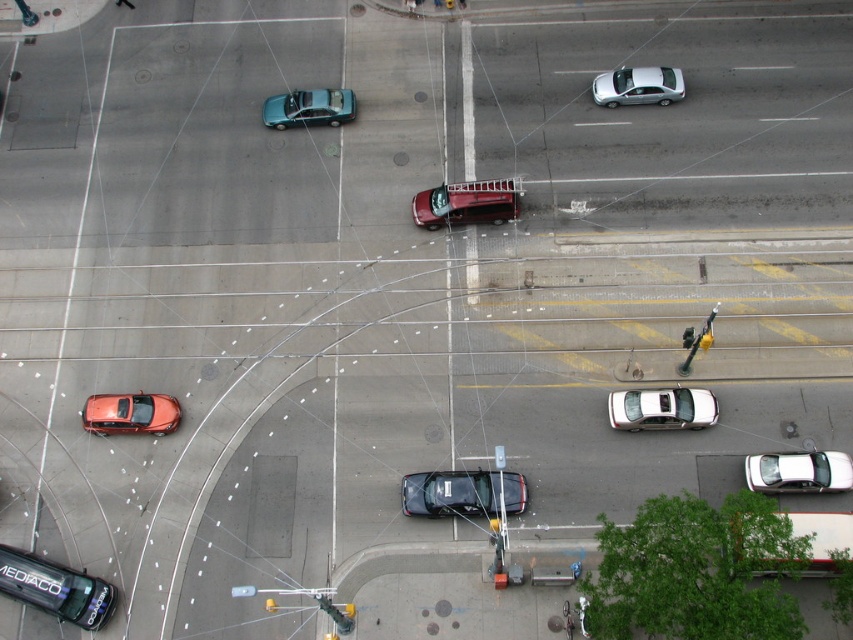
You are a drone operator flying a drone over the city intersection. Your drone is currently at point A, which is point (x=419, y=205), and you want to fly it to point B, which is point (x=822, y=548). Considering the overhead wires forming a network above the intersection, which point is closer to the drone when it is at point A?

Point A is closer to the drone when it is at point A because it is the current position of the drone. Point B is further away from the drone at point A.

You are a city planner analyzing the intersection. Considering the sizes of the metallic red fire truck at center and the metallic yellow traffic light at upper center, which object would require more space for maintenance access?

The metallic red fire truck at center is bigger than the metallic yellow traffic light at upper center, so it would require more space for maintenance access.